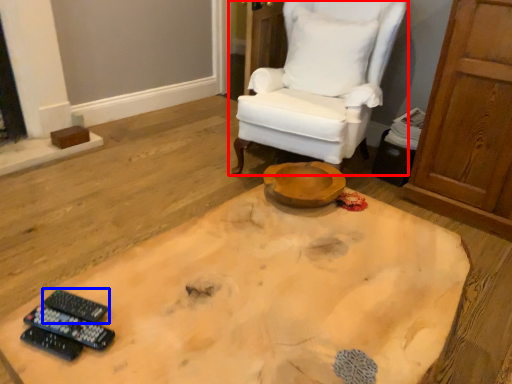
Question: Which point is closer to the camera, chair (highlighted by a red box) or remote control (highlighted by a blue box)?

Choices:
 (A) chair
 (B) remote control

Answer: (B)